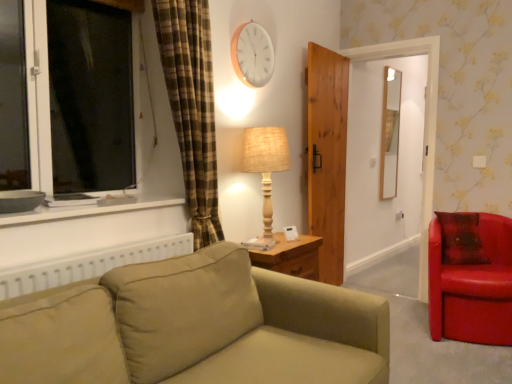
Question: From the image's perspective, is woven beige lamp at center on matte gray bowl at left?

Choices:
 (A) no
 (B) yes

Answer: (B)

Question: Can you confirm if woven beige lamp at center is taller than matte gray bowl at left?

Choices:
 (A) yes
 (B) no

Answer: (A)

Question: Is woven beige lamp at center positioned before matte gray bowl at left?

Choices:
 (A) yes
 (B) no

Answer: (B)

Question: Is woven beige lamp at center facing away from matte gray bowl at left?

Choices:
 (A) no
 (B) yes

Answer: (A)

Question: Is woven beige lamp at center at the left side of matte gray bowl at left?

Choices:
 (A) no
 (B) yes

Answer: (A)

Question: Is matte gray bowl at left situated inside woven beige lamp at center or outside?

Choices:
 (A) inside
 (B) outside

Answer: (B)

Question: Is point (16, 208) positioned closer to the camera than point (284, 162)?

Choices:
 (A) farther
 (B) closer

Answer: (B)

Question: From their relative heights in the image, would you say matte gray bowl at left is taller or shorter than woven beige lamp at center?

Choices:
 (A) short
 (B) tall

Answer: (A)

Question: Visually, is matte gray bowl at left positioned to the left or to the right of woven beige lamp at center?

Choices:
 (A) left
 (B) right

Answer: (A)

Question: Relative to wooden clock at upper center, is matte wooden mirror at upper right in front or behind?

Choices:
 (A) behind
 (B) front

Answer: (A)

Question: Based on their sizes in the image, would you say matte wooden mirror at upper right is bigger or smaller than wooden clock at upper center?

Choices:
 (A) big
 (B) small

Answer: (A)

Question: From their relative heights in the image, would you say matte wooden mirror at upper right is taller or shorter than wooden clock at upper center?

Choices:
 (A) short
 (B) tall

Answer: (B)

Question: From the image's perspective, relative to wooden clock at upper center, is matte wooden mirror at upper right above or below?

Choices:
 (A) above
 (B) below

Answer: (B)

Question: Is shiny leather armchair at right situated inside woven beige lamp at center or outside?

Choices:
 (A) inside
 (B) outside

Answer: (B)

Question: In the image, is shiny leather armchair at right positioned in front of or behind woven beige lamp at center?

Choices:
 (A) behind
 (B) front

Answer: (A)